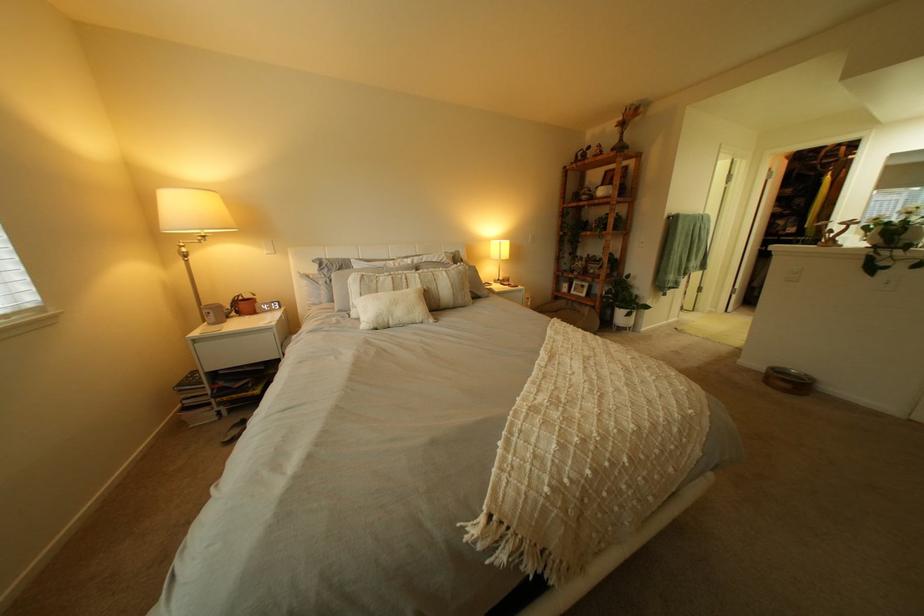
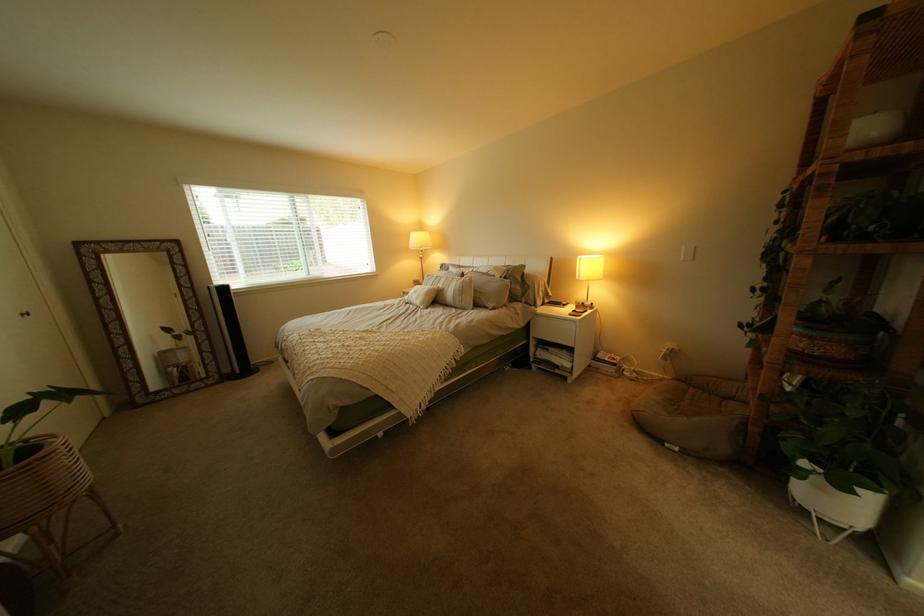
In the second image, find the point that corresponds to point (448, 288) in the first image.

(462, 290)